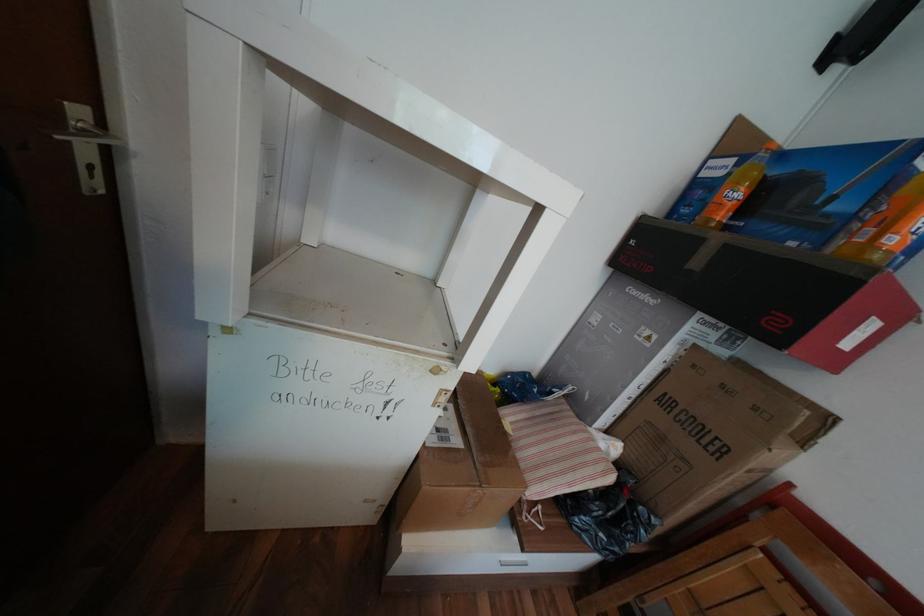
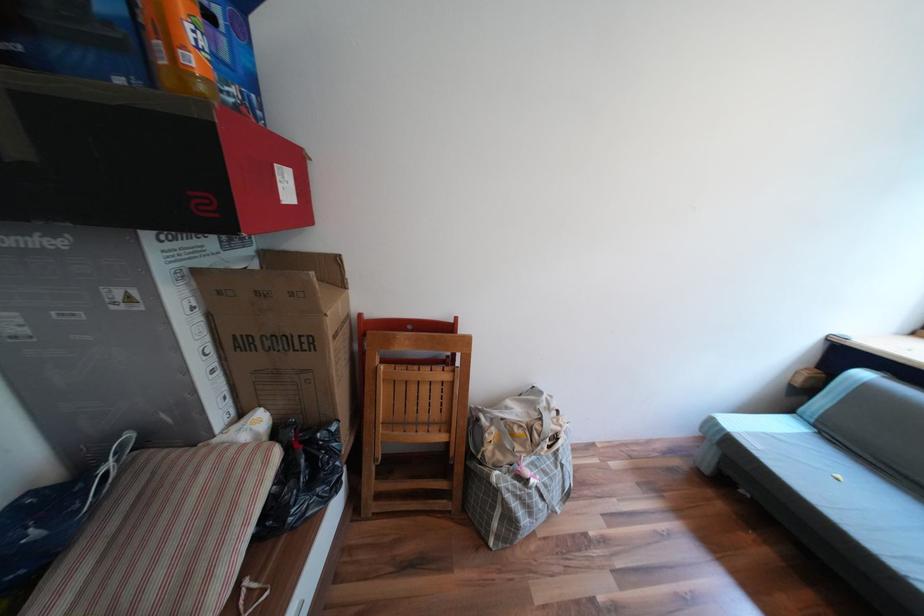
In the second image, find the point that corresponds to [604,462] in the first image.

(258, 464)